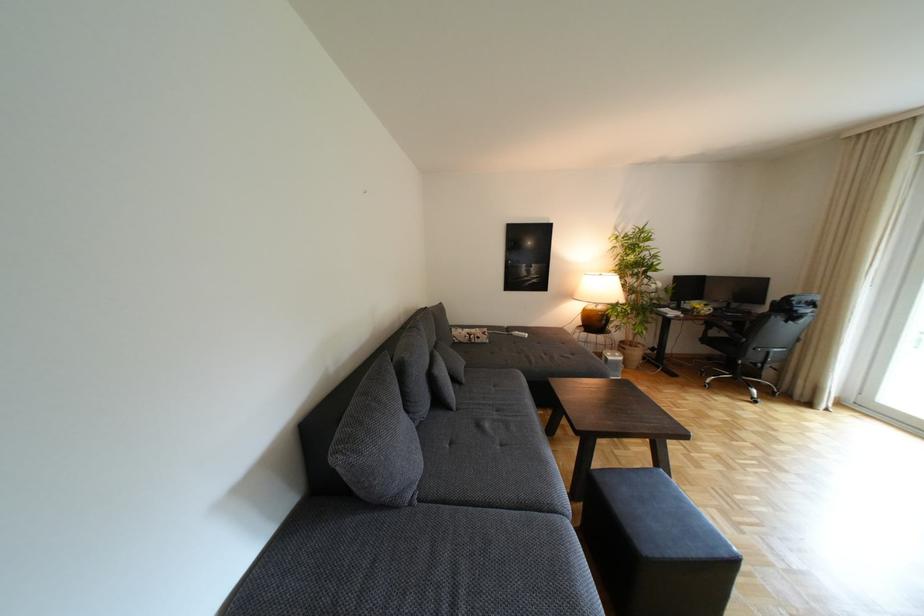
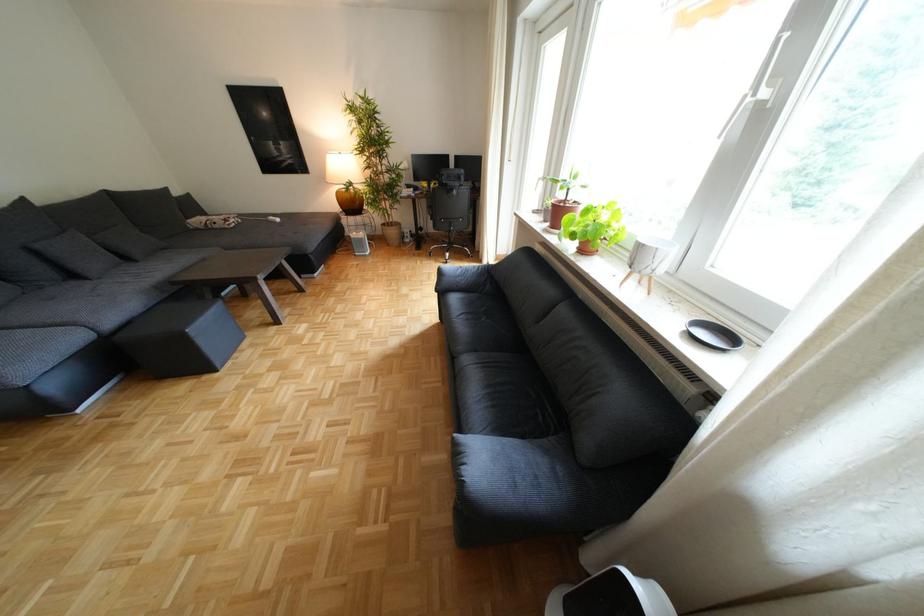
In the second image, find the point that corresponds to point (636, 342) in the first image.

(396, 224)